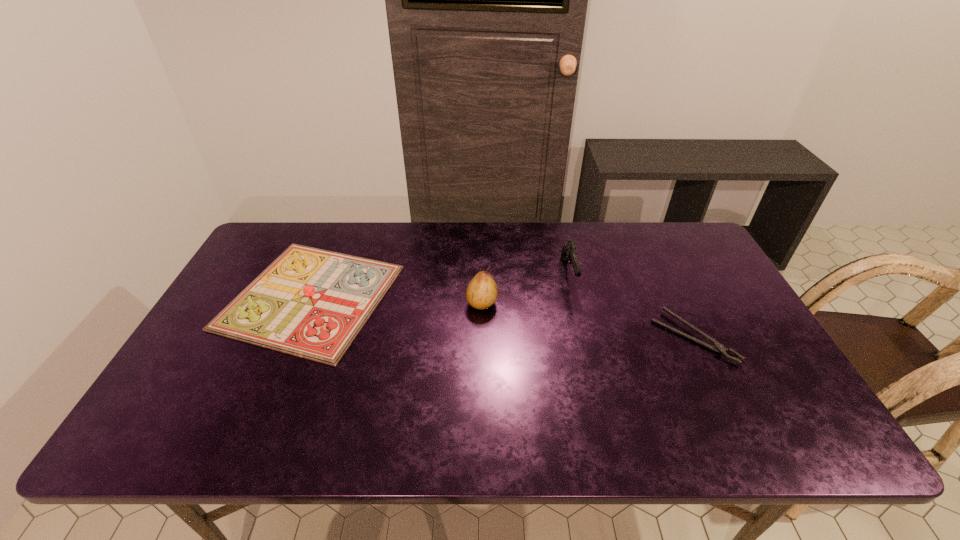
The width and height of the screenshot is (960, 540). In order to click on gun positioned at the far edge in this screenshot , I will do `click(569, 253)`.

Find the location of `gameboard positioned at the far edge`. gameboard positioned at the far edge is located at coordinates (312, 303).

This screenshot has width=960, height=540. I want to click on object located at the left edge, so click(312, 303).

This screenshot has width=960, height=540. I want to click on object that is at the right edge, so click(x=719, y=348).

The height and width of the screenshot is (540, 960). I want to click on object at the far left corner, so click(x=312, y=303).

This screenshot has height=540, width=960. Identify the location of vacant space at the far edge of the desktop. (628, 234).

Identify the location of free space at the near edge of the desktop. The width and height of the screenshot is (960, 540). (539, 448).

Locate an element on the screen. The image size is (960, 540). vacant region at the left edge of the desktop is located at coordinates (235, 292).

Find the location of a particular element. The width and height of the screenshot is (960, 540). vacant space at the far left corner is located at coordinates (249, 262).

In the image, there is a desktop. Where is `blank space at the far right corner`? This screenshot has width=960, height=540. blank space at the far right corner is located at coordinates (708, 255).